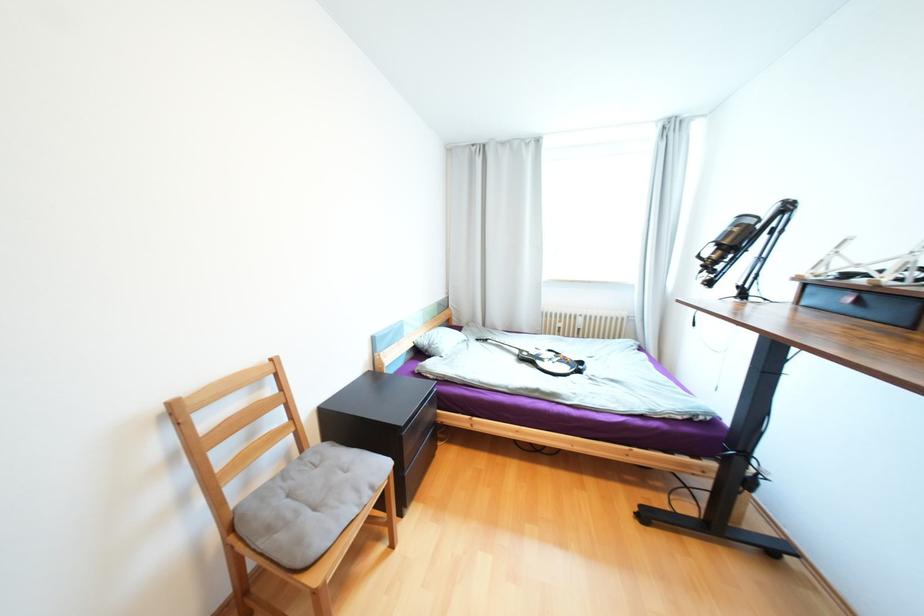
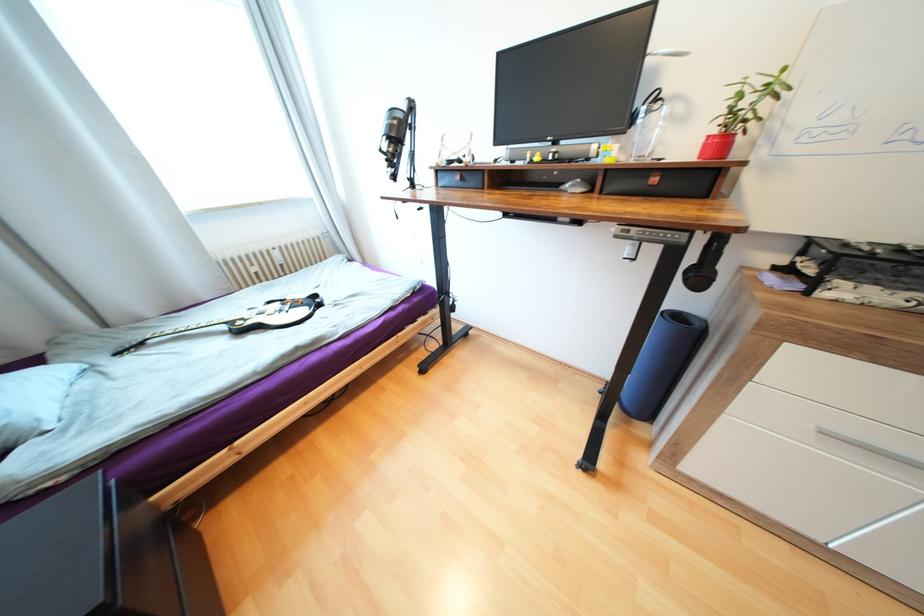
Based on the continuous images, in which direction is the camera rotating?

The camera's rotation is toward right-down.